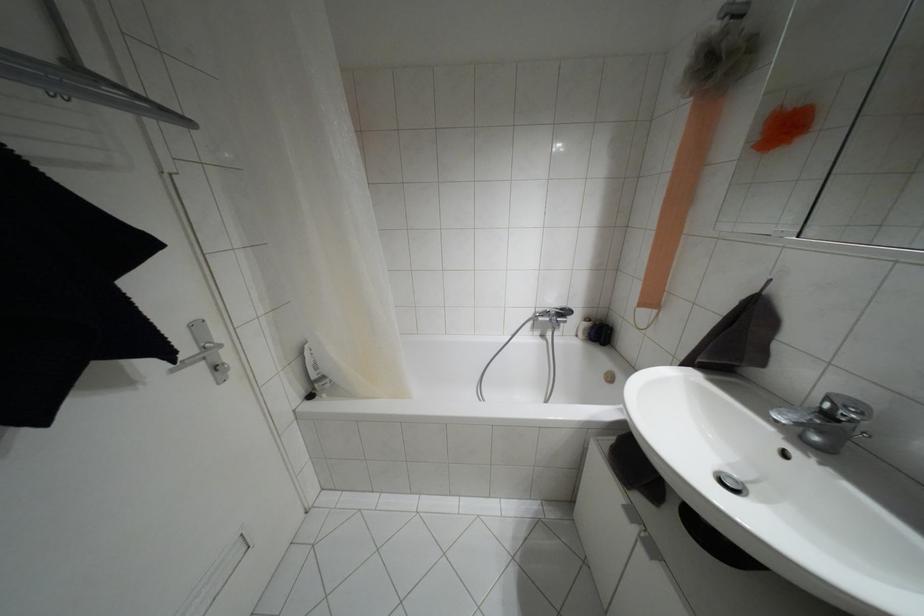
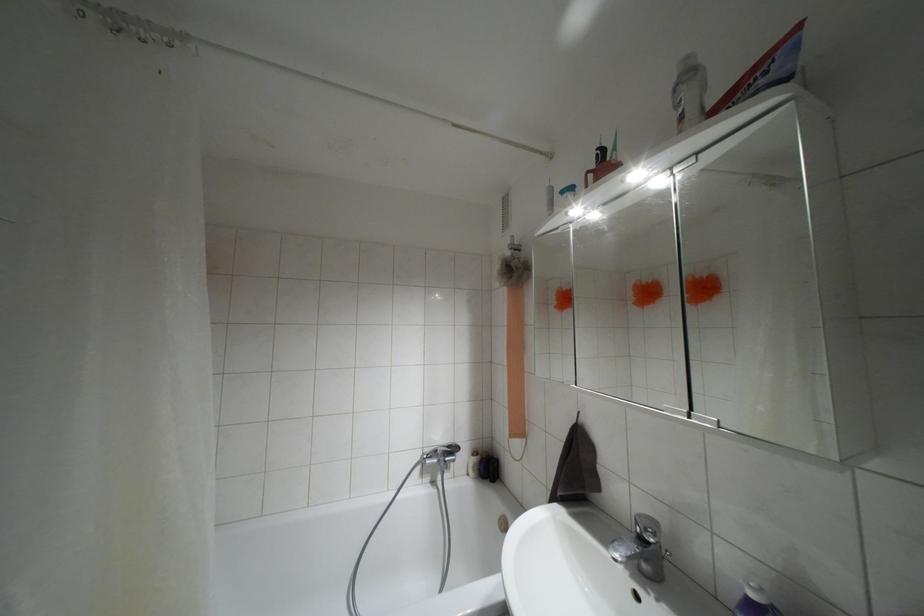
Locate, in the second image, the point that corresponds to (709,76) in the first image.

(509, 277)